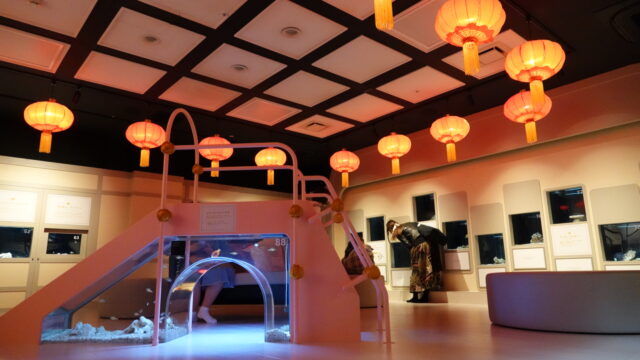
In order to click on tassel in this screenshot , I will do `click(472, 59)`.